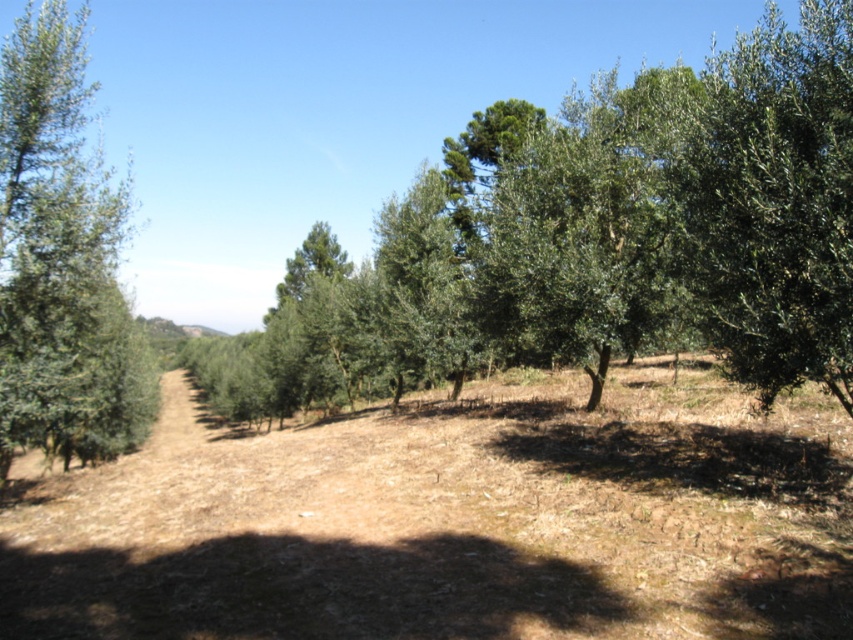
Question: Which point is farther to the camera?

Choices:
 (A) green leafy tree at right
 (B) green leafy tree at center
 (C) green leafy tree at left

Answer: (C)

Question: Does green leafy tree at center have a smaller size compared to green leafy tree at left?

Choices:
 (A) yes
 (B) no

Answer: (A)

Question: Is green leafy tree at center wider than green leafy tree at left?

Choices:
 (A) no
 (B) yes

Answer: (B)

Question: Which point is farther to the camera?

Choices:
 (A) (805, 317)
 (B) (734, 115)
 (C) (57, 67)

Answer: (C)

Question: Can you confirm if green leafy tree at center is bigger than green leafy tree at right?

Choices:
 (A) yes
 (B) no

Answer: (A)

Question: Which point is closer to the camera?

Choices:
 (A) (799, 84)
 (B) (833, 368)
 (C) (7, 84)

Answer: (B)